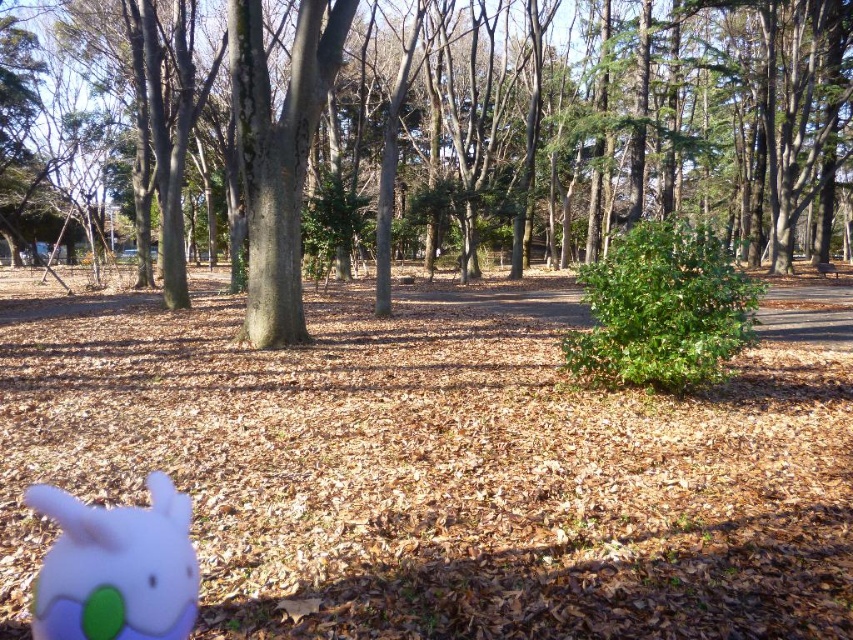
You are a photographer setting up a shot in the park. You have a white matte plush toy at lower left and a brown textured tree at center in your frame. Which object would appear bigger in the final photo?

The brown textured tree at center appears bigger in the final photo because it has a larger size compared to the white matte plush toy at lower left.

You are a photographer setting up a shot of the brown textured tree at center and the white matte plush toy at lower left. Which object should you focus on if you want the taller one to be in sharp focus?

You should focus on the brown textured tree at center because it is taller than the white matte plush toy at lower left.

You are a photographer setting up a shot in the park. You have a white matte plush toy at lower left and a brown textured tree at center in your frame. Which object occupies more horizontal space in the image?

The brown textured tree at center is wider than the white matte plush toy at lower left, so it occupies more horizontal space in the image.